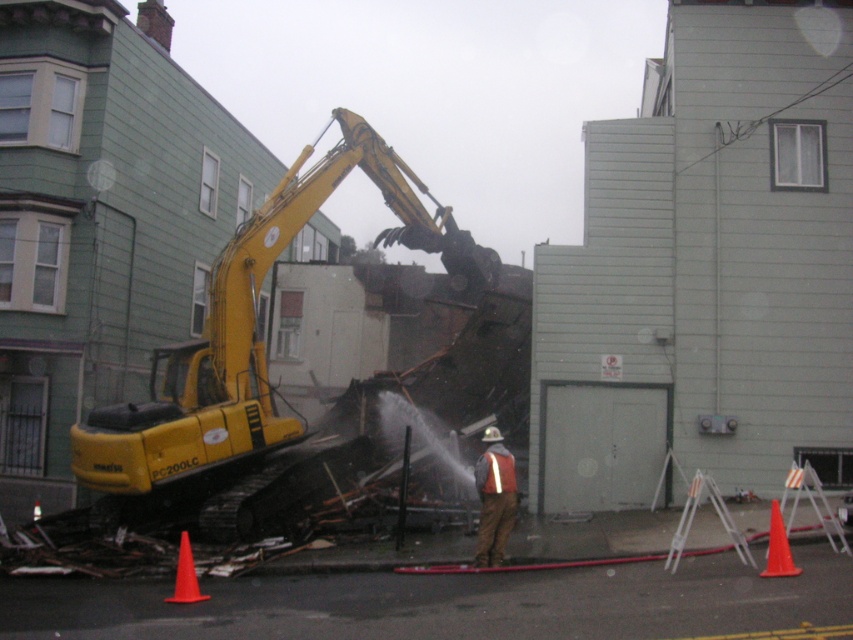
You are a delivery driver approaching the construction site. You need to navigate around the orange matte traffic cone at lower right and the reflective fabric safety vest at center. Which object should you avoid first to stay on the safest path?

You should avoid the orange matte traffic cone at lower right first because it is closer to you than the reflective fabric safety vest at center, so it poses an immediate obstacle.

You are a safety inspector at the construction site. You need to ensure that the orange matte traffic cone at lower right and the orange matte traffic cone at lower left are properly spaced to block off the demolition area. Given that the smaller cone is less stable, which cone should you check first for potential tipping risks?

The orange matte traffic cone at lower right has a smaller size compared to orange matte traffic cone at lower left, so you should check the orange matte traffic cone at lower right first since its smaller size makes it less stable and more prone to tipping.

You are a safety inspector at the construction site. You need to place a new traffic cone to block off the area near the excavator. The existing traffic cone is at point (778, 547). Where should you place the new traffic cone relative to the existing one to ensure maximum safety?

The orange matte traffic cone at lower right is represented by point (778, 547). To ensure maximum safety, the new traffic cone should be placed further away from the excavator, maintaining a safe distance from the ongoing demolition activities.